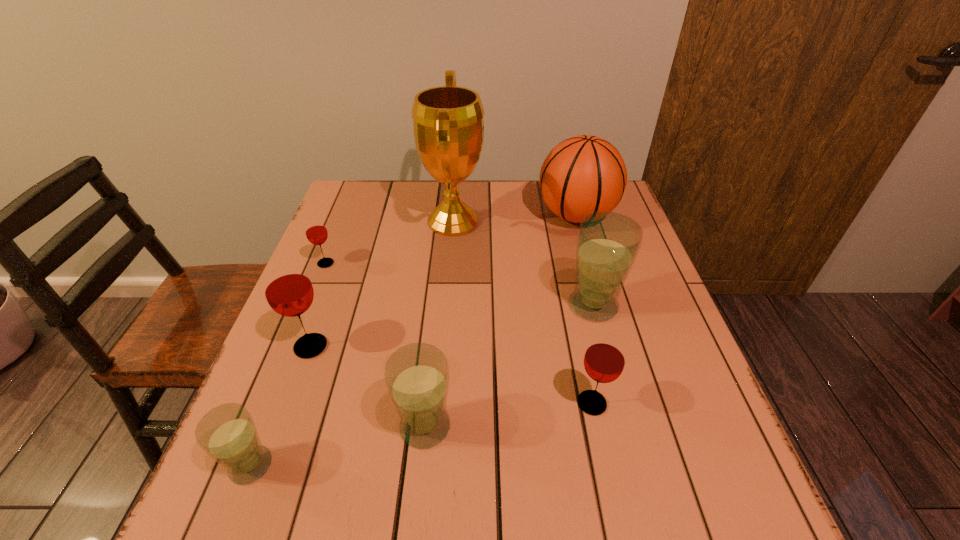
You are a GUI agent. You are given a task and a screenshot of the screen. Output one action in this format:
    pyautogui.click(x=<x>, y=<y>)
    Task: Click on the second biggest blue glass
    This screenshot has height=540, width=960.
    Given the screenshot: What is the action you would take?
    pyautogui.click(x=417, y=377)

Identify the location of the farthest glass. The height and width of the screenshot is (540, 960). (316, 232).

Locate an element on the screen. the smallest red glass is located at coordinates (316, 232).

I want to click on the leftmost blue glass, so click(227, 433).

The width and height of the screenshot is (960, 540). Find the location of `vacant area situated on the front-facing side of the award`. vacant area situated on the front-facing side of the award is located at coordinates (612, 222).

Where is `free location located 0.290m on the front of the orange basketball`? This screenshot has height=540, width=960. free location located 0.290m on the front of the orange basketball is located at coordinates (605, 315).

Where is `vacant space situated 0.060m on the right of the second farthest glass`? Image resolution: width=960 pixels, height=540 pixels. vacant space situated 0.060m on the right of the second farthest glass is located at coordinates (646, 306).

Identify the location of free space located 0.370m on the right of the biggest red glass. (501, 347).

Locate an element on the screen. Image resolution: width=960 pixels, height=540 pixels. free location located 0.090m on the back of the second biggest red glass is located at coordinates (581, 352).

The width and height of the screenshot is (960, 540). What are the coordinates of `vacant area located on the back of the second blue glass from right to left` in the screenshot? It's located at [438, 300].